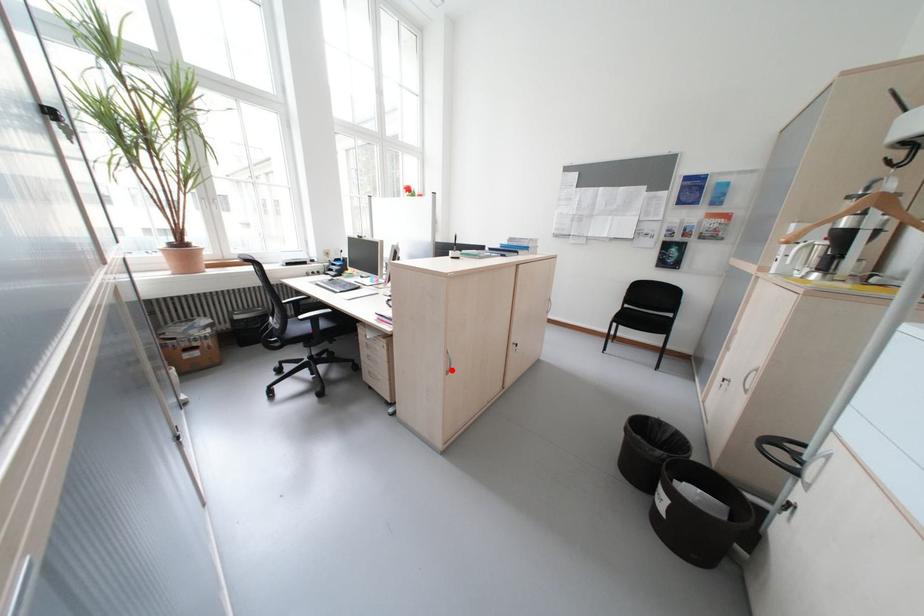
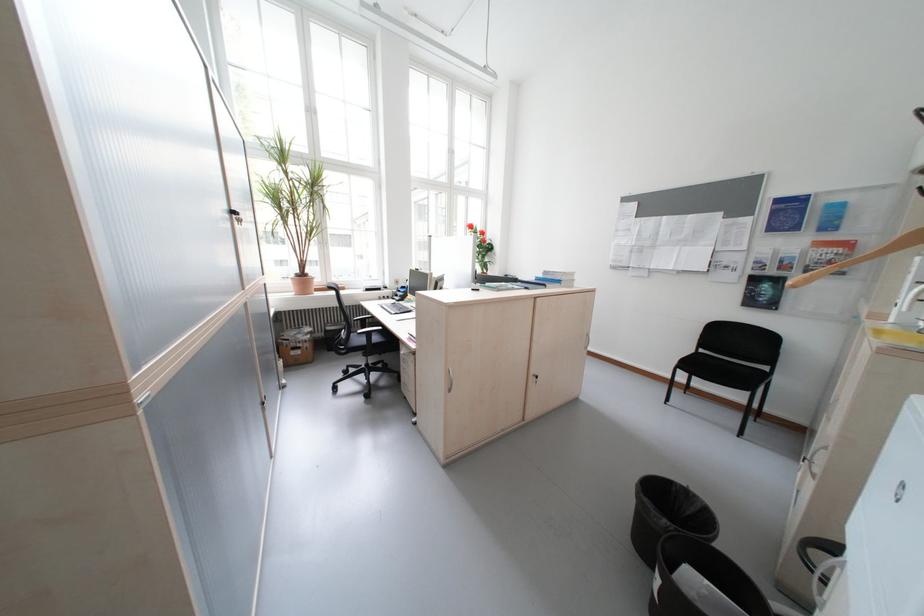
Locate, in the second image, the point that corresponds to the highlighted location in the first image.

(453, 387)